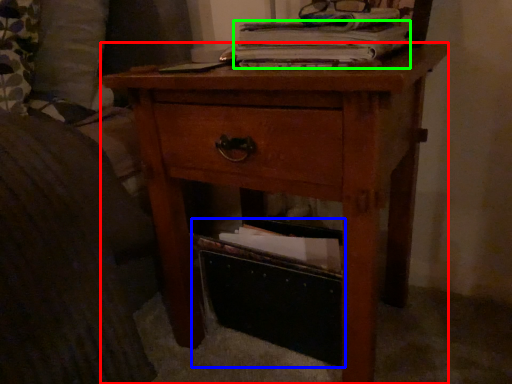
Question: Which object is positioned closest to nightstand (highlighted by a red box)? Select from storage box (highlighted by a blue box) and paperback book (highlighted by a green box).

Choices:
 (A) storage box
 (B) paperback book

Answer: (A)